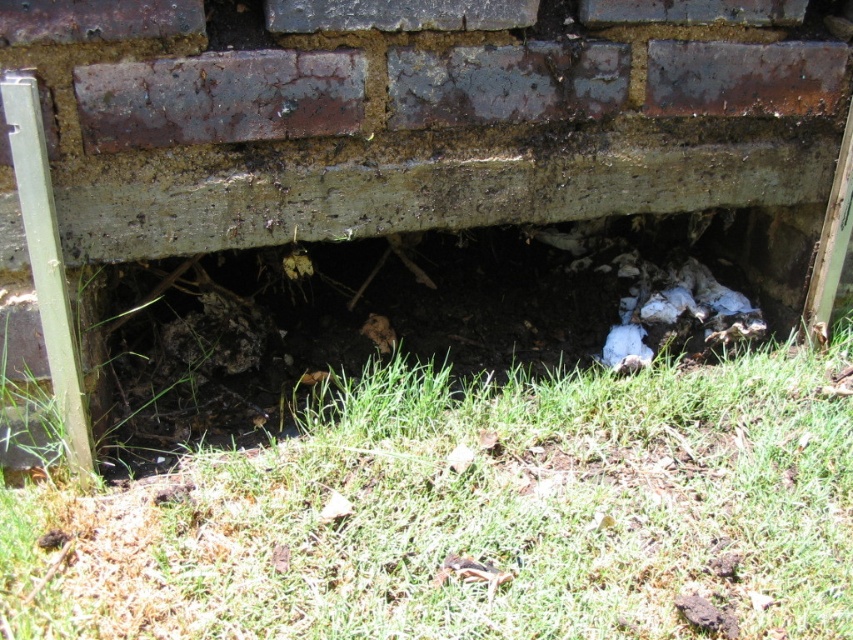
Question: Which object appears farthest from the camera in this image?

Choices:
 (A) green grass at lower center
 (B) dull concrete hole at center

Answer: (B)

Question: Where is green grass at lower center located in relation to dull concrete hole at center in the image?

Choices:
 (A) right
 (B) left

Answer: (A)

Question: Does green grass at lower center have a smaller size compared to dull concrete hole at center?

Choices:
 (A) yes
 (B) no

Answer: (A)

Question: Does green grass at lower center come in front of dull concrete hole at center?

Choices:
 (A) no
 (B) yes

Answer: (B)